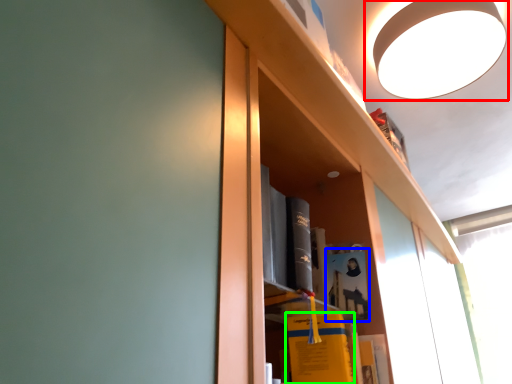
Question: Based on their relative distances, which object is farther from lamp (highlighted by a red box)? Choose from book (highlighted by a blue box) and book (highlighted by a green box).

Choices:
 (A) book
 (B) book

Answer: (B)